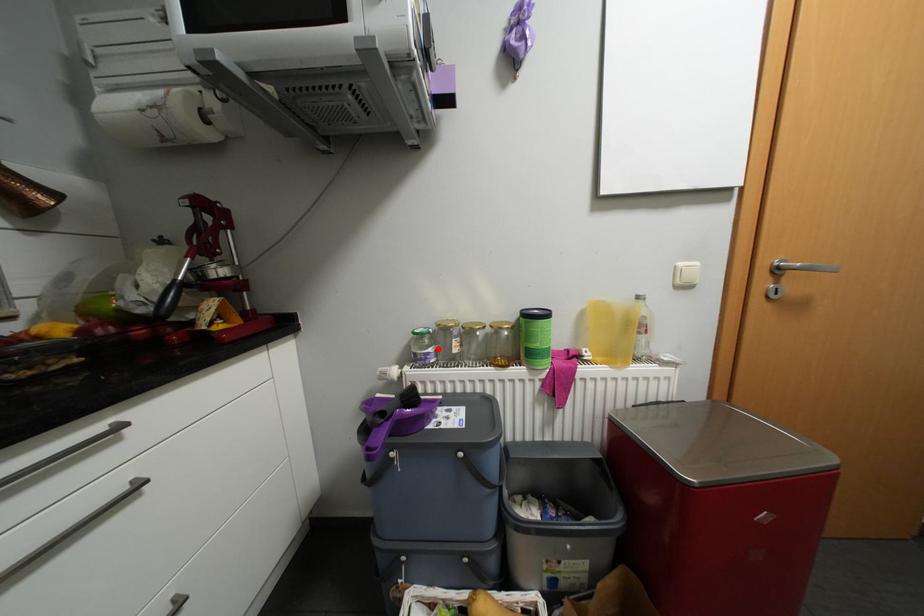
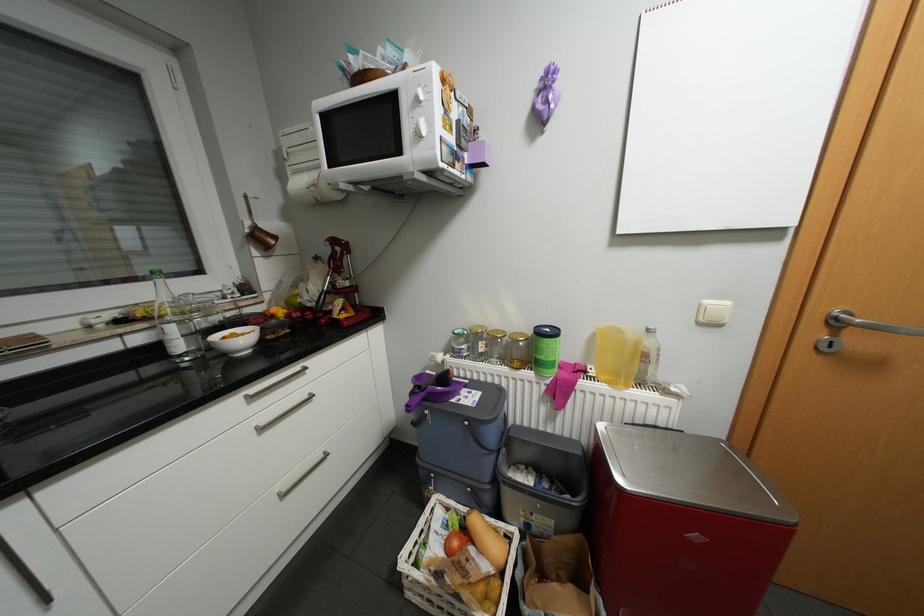
In the second image, find the point that corresponds to the highlighted location in the first image.

(471, 345)